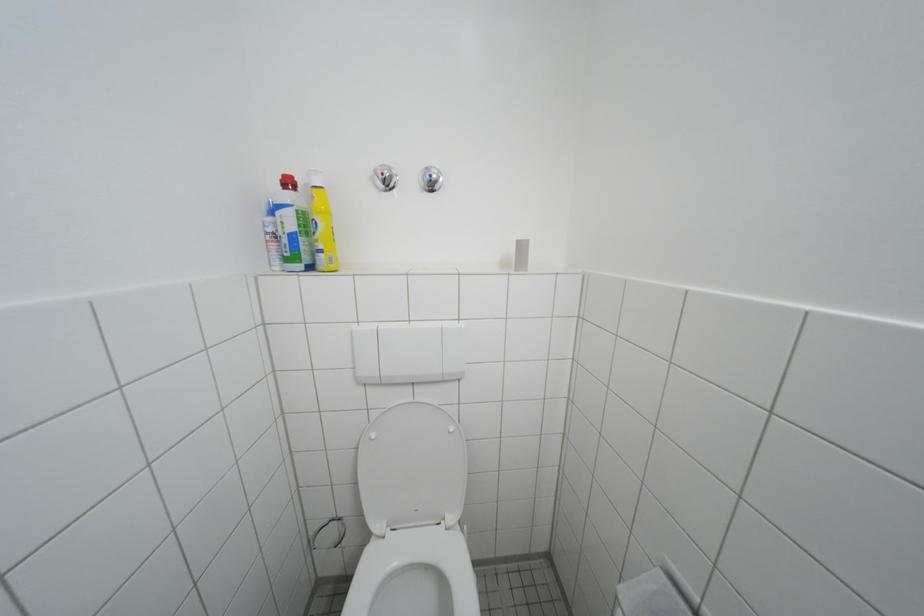
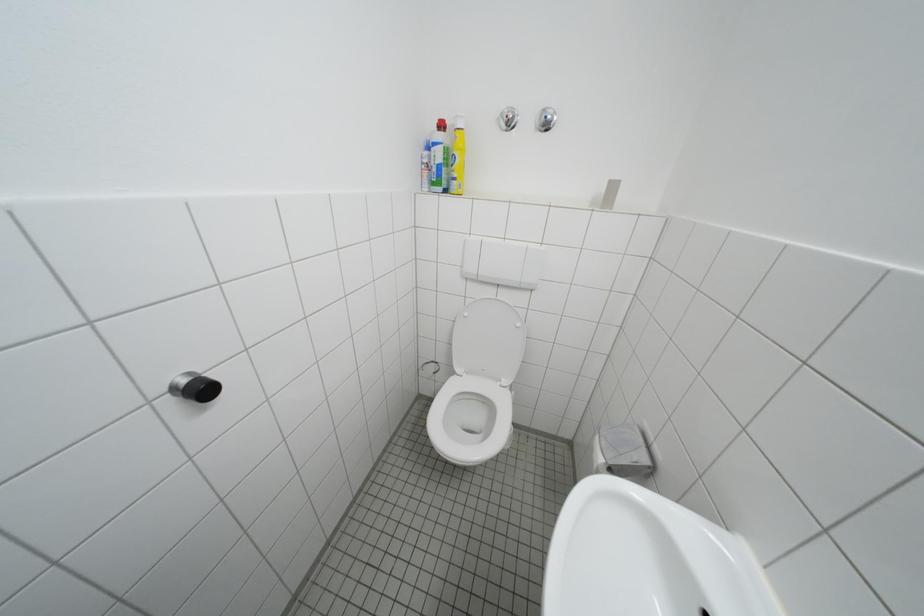
Question: What movement of the cameraman would produce the second image?

Choices:
 (A) Left
 (B) Right
 (C) Forward
 (D) Backward

Answer: (D)